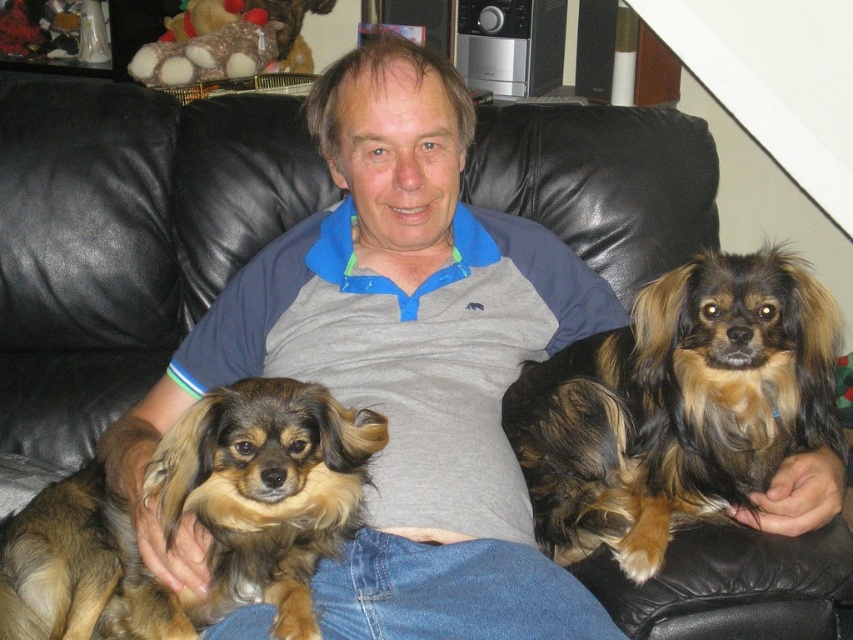
Question: Which point is closer to the camera?

Choices:
 (A) (77, 593)
 (B) (682, 499)

Answer: (A)

Question: Which point is farther to the camera?

Choices:
 (A) brown shaggy dog at right
 (B) fuzzy brown dog at center

Answer: (A)

Question: Does brown shaggy dog at right have a greater width compared to fuzzy brown dog at center?

Choices:
 (A) no
 (B) yes

Answer: (B)

Question: Which of the following is the farthest from the observer?

Choices:
 (A) fuzzy brown dog at center
 (B) brown shaggy dog at right

Answer: (B)

Question: Does brown shaggy dog at right appear on the right side of fuzzy brown dog at center?

Choices:
 (A) no
 (B) yes

Answer: (B)

Question: Is brown shaggy dog at right to the left of fuzzy brown dog at center from the viewer's perspective?

Choices:
 (A) yes
 (B) no

Answer: (B)